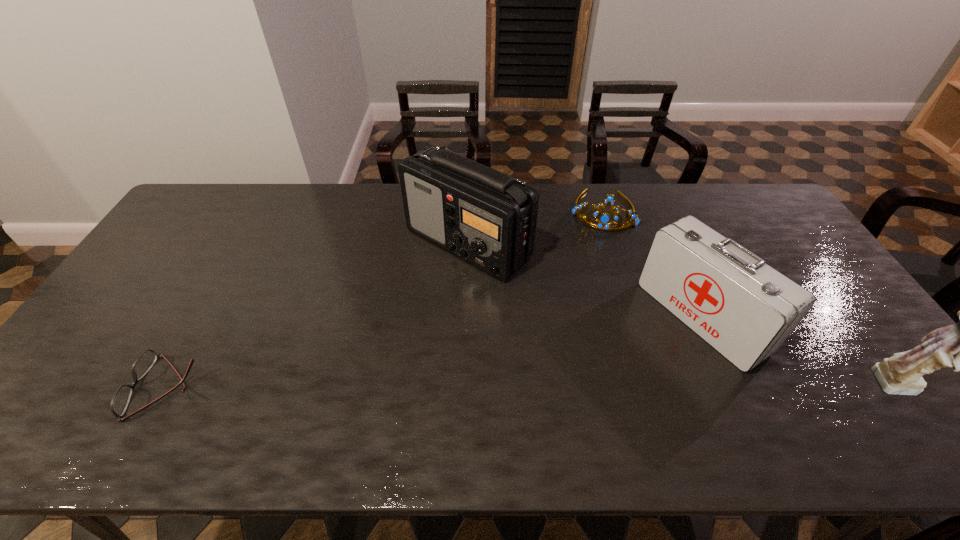
Where is `vacant space that satisfies the following two spatial constraints: 1. on the front side of the radio receiver; 2. on the front-facing side of the figurine`? The width and height of the screenshot is (960, 540). vacant space that satisfies the following two spatial constraints: 1. on the front side of the radio receiver; 2. on the front-facing side of the figurine is located at coordinates (464, 387).